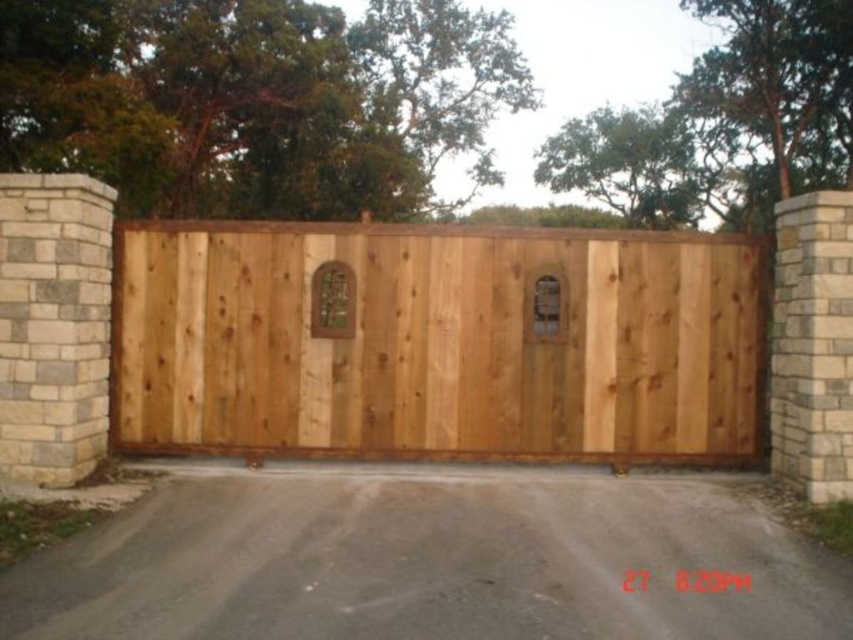
Identify the location of natural wood gate at center. This screenshot has width=853, height=640. (436, 340).

The image size is (853, 640). Identify the location of natural wood gate at center. (436, 340).

Between natural wood gate at center and natural wood door at center, which one is positioned lower?

natural wood gate at center is lower down.

Is natural wood gate at center to the right of natural wood door at center from the viewer's perspective?

Yes, natural wood gate at center is to the right of natural wood door at center.

Measure the distance between point (259, 390) and camera.

Point (259, 390) and camera are 8.93 meters apart.

The image size is (853, 640). Identify the location of natural wood gate at center. (436, 340).

Is gray concrete driveway at center closer to camera compared to natural wood door at center?

Yes.

Measure the distance between point [172,561] and camera.

The distance of point [172,561] from camera is 6.19 meters.

Locate an element on the screen. This screenshot has height=640, width=853. gray concrete driveway at center is located at coordinates (428, 561).